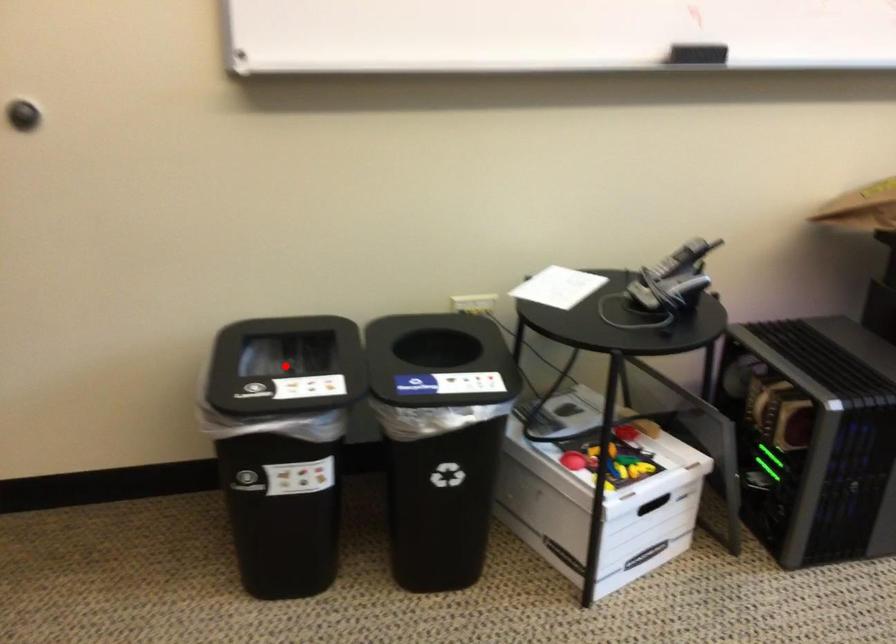
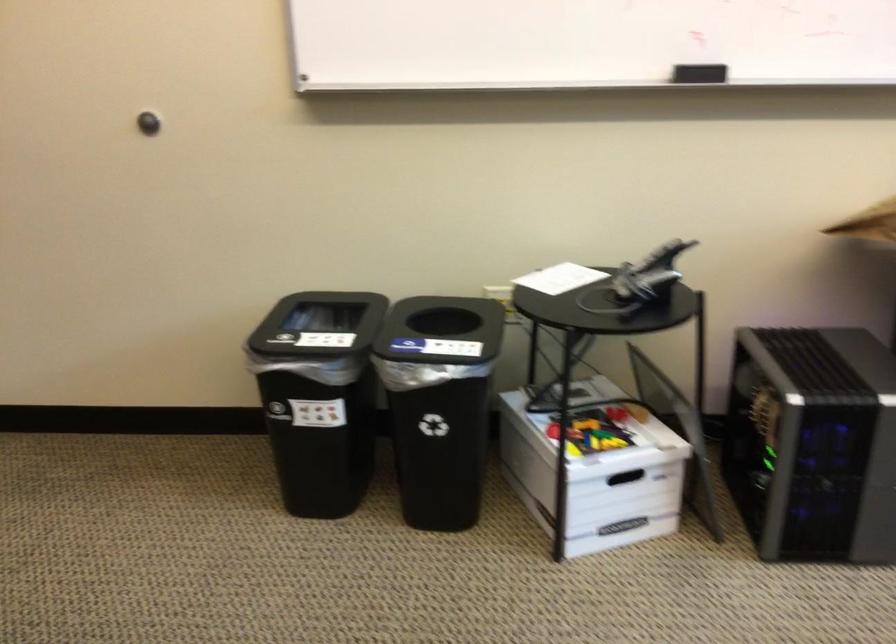
In the second image, find the point that corresponds to the highlighted location in the first image.

(336, 330)